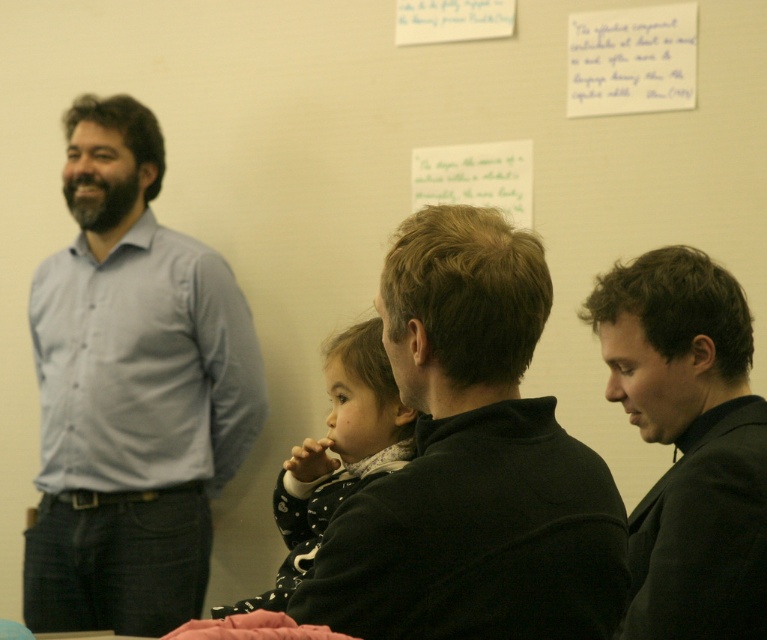
Question: Which is nearer to the light blue shirt at left?

Choices:
 (A) black matte jacket at right
 (B) black fleece at center

Answer: (A)

Question: Which object is farther from the camera taking this photo?

Choices:
 (A) black fleece at center
 (B) light blue shirt at left

Answer: (B)

Question: Does light blue shirt at left have a greater width compared to white dotted coat at center?

Choices:
 (A) yes
 (B) no

Answer: (A)

Question: Can you confirm if black matte jacket at right is wider than white dotted coat at center?

Choices:
 (A) no
 (B) yes

Answer: (A)

Question: Which object appears closest to the camera in this image?

Choices:
 (A) white dotted coat at center
 (B) black fleece at center

Answer: (B)

Question: Can you confirm if black fleece at center is smaller than black matte jacket at right?

Choices:
 (A) yes
 (B) no

Answer: (A)